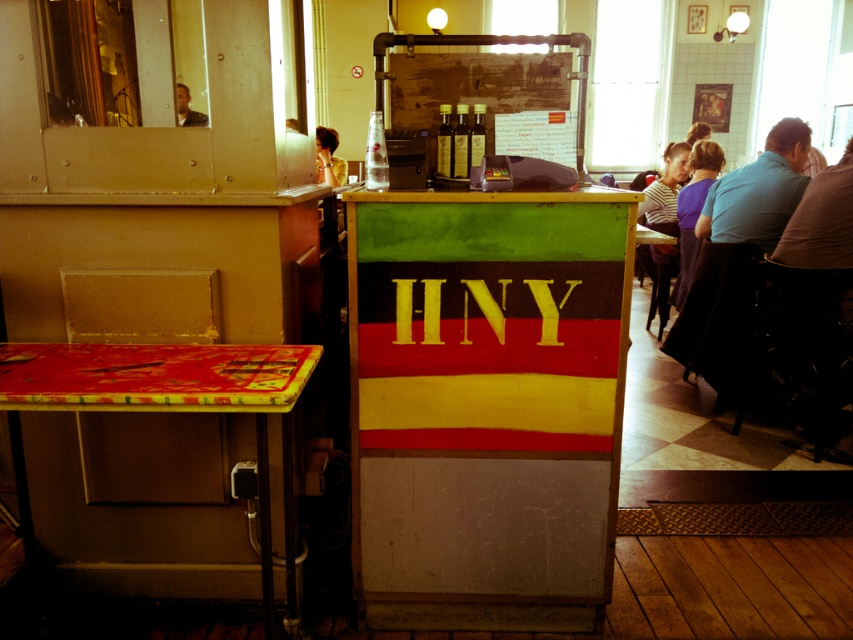
Is blue fabric shirt at right positioned at the back of yellow shirt at upper left?

No, it is in front of yellow shirt at upper left.

Does blue fabric shirt at right appear on the left side of yellow shirt at upper left?

No, blue fabric shirt at right is not to the left of yellow shirt at upper left.

Which is in front, point (740, 204) or point (332, 179)?

Point (740, 204)

Locate an element on the screen. The width and height of the screenshot is (853, 640). blue fabric shirt at right is located at coordinates 759,189.

Is shiny plastic table at left bigger than blue fabric shirt at right?

Correct, shiny plastic table at left is larger in size than blue fabric shirt at right.

Who is taller, shiny plastic table at left or blue fabric shirt at right?

With more height is shiny plastic table at left.

The height and width of the screenshot is (640, 853). What do you see at coordinates (175, 403) in the screenshot? I see `shiny plastic table at left` at bounding box center [175, 403].

Where is `shiny plastic table at left`? Image resolution: width=853 pixels, height=640 pixels. shiny plastic table at left is located at coordinates (175, 403).

Is blue fabric shirt at right shorter than matte black hair at upper left?

No.

Is point (792, 173) positioned behind point (196, 125)?

Yes, it is behind point (196, 125).

Is point (744, 188) positioned in front of point (183, 97)?

No, (744, 188) is behind (183, 97).

In order to click on blue fabric shirt at right in this screenshot , I will do `click(759, 189)`.